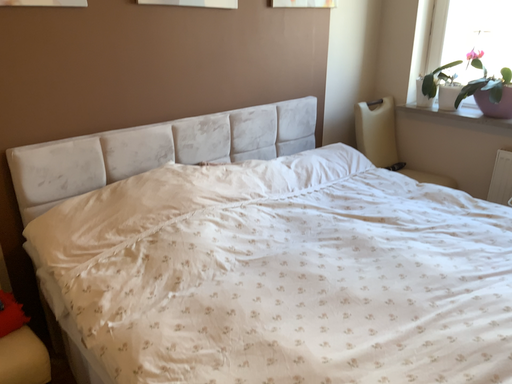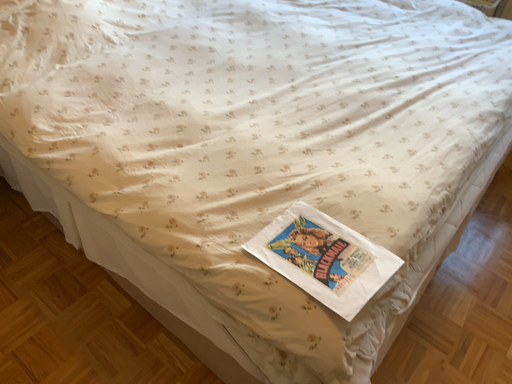
Question: How did the camera likely rotate when shooting the video?

Choices:
 (A) rotated right
 (B) rotated left

Answer: (A)